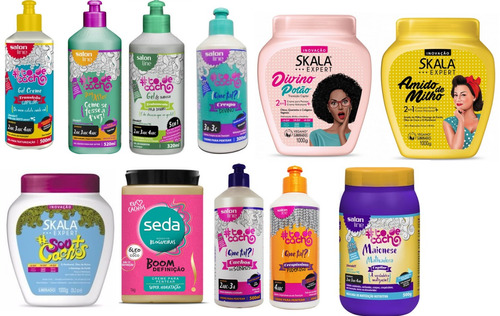
The width and height of the screenshot is (500, 316). Identify the location of bottles. (32, 73), (101, 77), (155, 84), (213, 78), (280, 72), (418, 73), (381, 206), (303, 228), (79, 255).